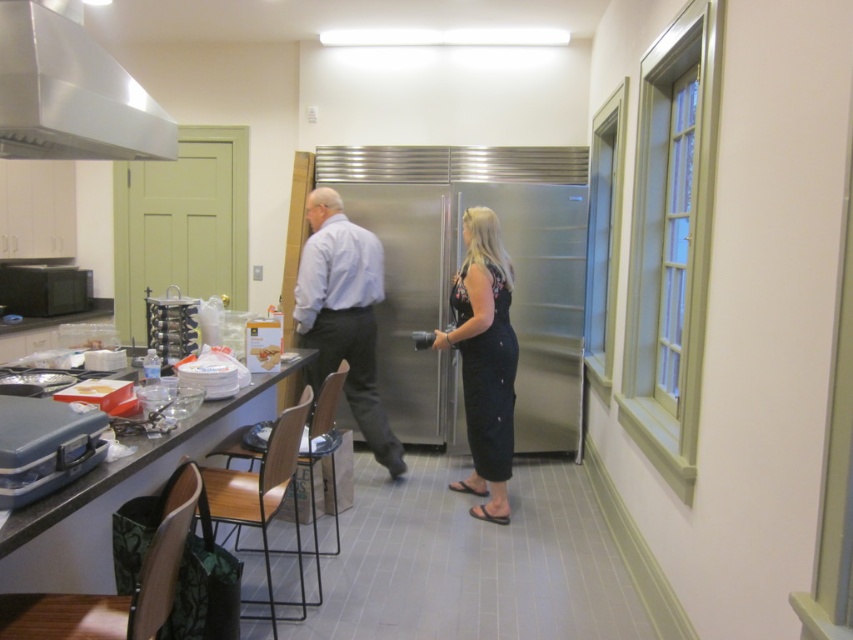
You are standing in the kitchen and want to take a photo of the matte black countertop at lower left using the camera held by the person in the black sleeveless dress. To do this, you need to position yourself so that the stainless steel exhaust hood at upper left is not blocking your view. Is this possible given their current positions?

The stainless steel exhaust hood at upper left is to the left of the matte black countertop at lower left, so positioning yourself to the right side of the countertop would allow you to capture the countertop without the exhaust hood blocking the view.

You are standing in the kitchen and need to hand a tool to both the light blue shirt at center and the black floral dress at center. Which person would you need to reach higher to give the tool to?

The light blue shirt at center is much taller than the black floral dress at center, so you would need to reach higher to give the tool to the light blue shirt at center.